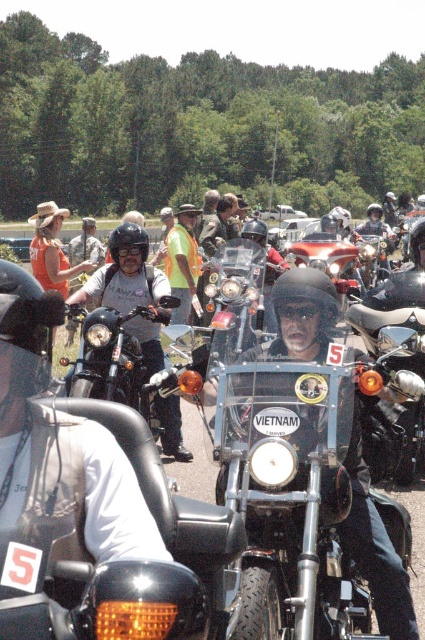
Who is higher up, metallic chrome motorcycle at center or matte black motorcycle at center?

matte black motorcycle at center is above.

Which is in front, point (342, 536) or point (155, 340)?

Positioned in front is point (342, 536).

Between point (274, 403) and point (173, 424), which one is positioned in front?

Point (274, 403) is more forward.

Identify the location of metallic chrome motorcycle at center. (x=303, y=497).